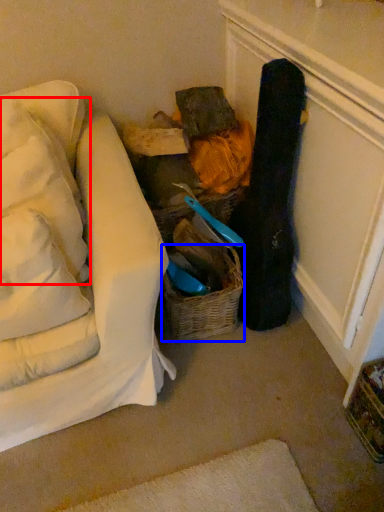
Question: Which object appears farthest to the camera in this image, pillow (highlighted by a red box) or basket (highlighted by a blue box)?

Choices:
 (A) pillow
 (B) basket

Answer: (B)